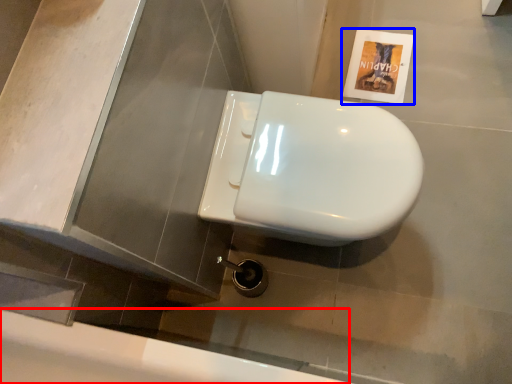
Question: Which of the following is the farthest to the observer, bath (highlighted by a red box) or flyer (highlighted by a blue box)?

Choices:
 (A) bath
 (B) flyer

Answer: (B)